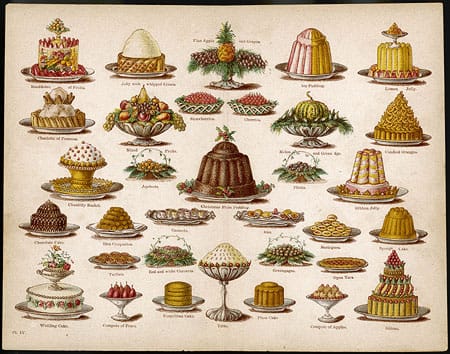
Locate an element on the screen. cake platter is located at coordinates (286, 305), (386, 240), (400, 196), (410, 79), (323, 79), (143, 77), (73, 79), (68, 130), (59, 235), (58, 317).